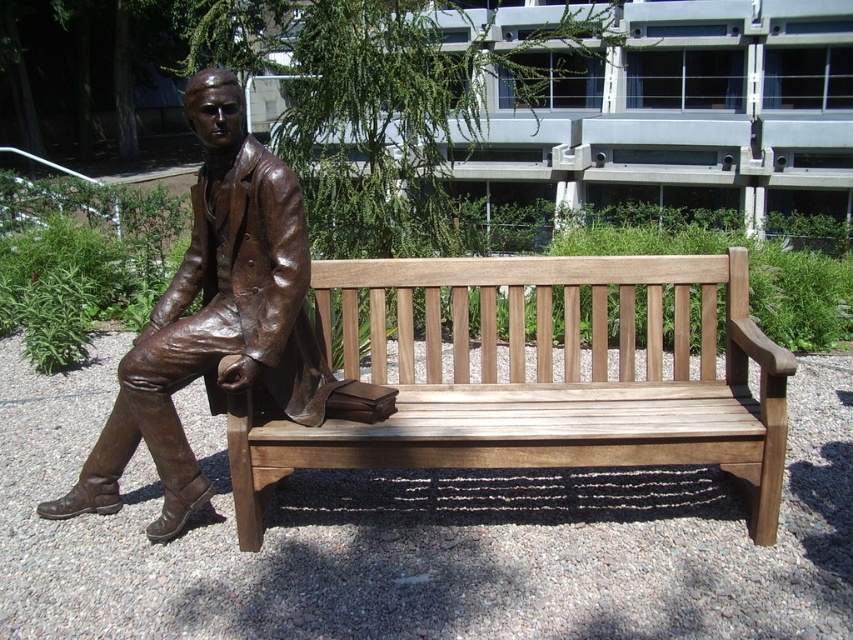
Does light brown wood bench at center appear on the right side of bronze statue at center?

Indeed, light brown wood bench at center is positioned on the right side of bronze statue at center.

Who is more forward, (233,493) or (265,307)?

Point (265,307) is more forward.

This screenshot has width=853, height=640. What do you see at coordinates (537, 380) in the screenshot? I see `light brown wood bench at center` at bounding box center [537, 380].

Locate an element on the screen. The width and height of the screenshot is (853, 640). light brown wood bench at center is located at coordinates (537, 380).